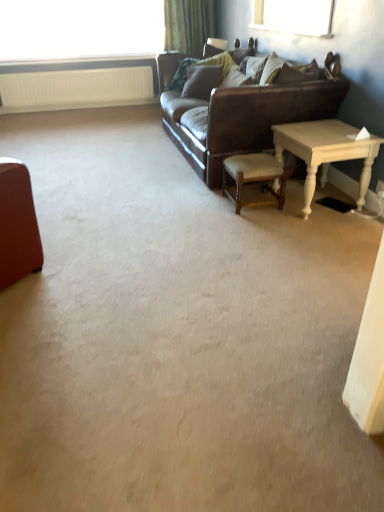
The width and height of the screenshot is (384, 512). Identify the location of free spot to the left of leather couch at center. (104, 161).